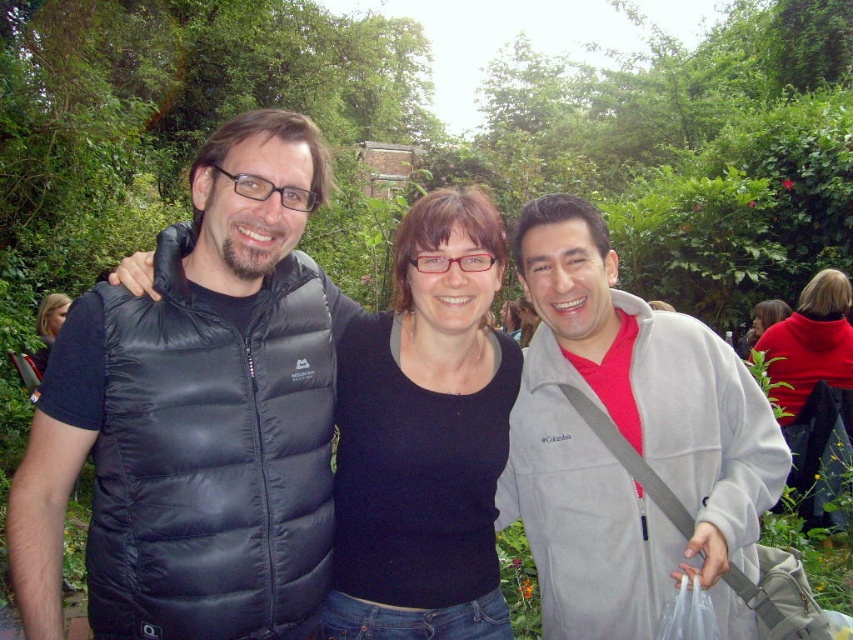
The image size is (853, 640). Identify the location of black puffy vest at left. (194, 417).

Between black puffy vest at left and black matte shirt at center, which one has more height?

Standing taller between the two is black puffy vest at left.

At what (x,y) coordinates should I click in order to perform the action: click on black puffy vest at left. Please return your answer as a coordinate pair (x, y). This screenshot has height=640, width=853. Looking at the image, I should click on (194, 417).

Does point (128, 333) come behind point (428, 301)?

No, it is in front of (428, 301).

Who is taller, black puffy vest at left or black matte sweater at center?

With more height is black puffy vest at left.

Which is in front, point (239, 198) or point (386, 579)?

Point (239, 198) is more forward.

Locate an element on the screen. The height and width of the screenshot is (640, 853). black puffy vest at left is located at coordinates (194, 417).

Is black matte sweater at center positioned behind matte red sweater at right?

No, it is not.

Can you confirm if black matte sweater at center is positioned to the left of matte red sweater at right?

Indeed, black matte sweater at center is positioned on the left side of matte red sweater at right.

Between point (440, 404) and point (821, 381), which one is positioned behind?

The point (821, 381) is more distant.

This screenshot has width=853, height=640. Find the location of `black matte sweater at center`. black matte sweater at center is located at coordinates (425, 436).